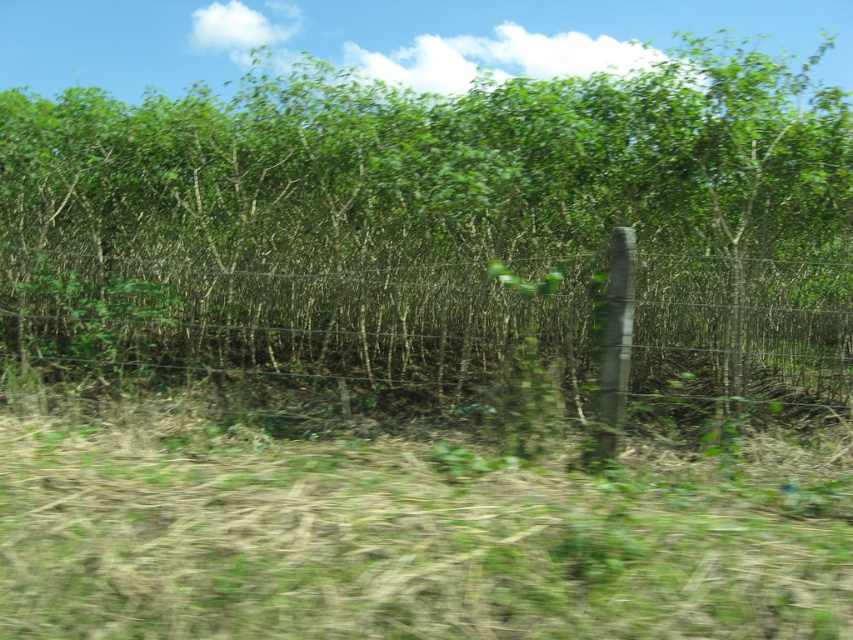
Who is shorter, green grass at lower center or wire mesh fence at center?

wire mesh fence at center

Does green grass at lower center come in front of wire mesh fence at center?

Yes.

Which is behind, point (48, 417) or point (418, 372)?

Point (418, 372)

Image resolution: width=853 pixels, height=640 pixels. I want to click on green grass at lower center, so click(x=407, y=540).

Which is in front, point (328, 147) or point (784, 355)?

Point (328, 147) is more forward.

Is green leafy tree at center positioned behind wire mesh fence at center?

Yes, green leafy tree at center is behind wire mesh fence at center.

Is point (294, 76) positioned before point (405, 316)?

No, it is not.

Find the location of `green leafy tree at center`. green leafy tree at center is located at coordinates (434, 230).

Where is `green leafy tree at center`? The width and height of the screenshot is (853, 640). green leafy tree at center is located at coordinates (434, 230).

In the scene shown: Between green leafy tree at center and green grass at lower center, which one appears on the right side from the viewer's perspective?

green leafy tree at center is more to the right.

Which is in front, point (480, 195) or point (450, 596)?

Point (450, 596) is in front.

This screenshot has width=853, height=640. Find the location of `green leafy tree at center`. green leafy tree at center is located at coordinates (434, 230).